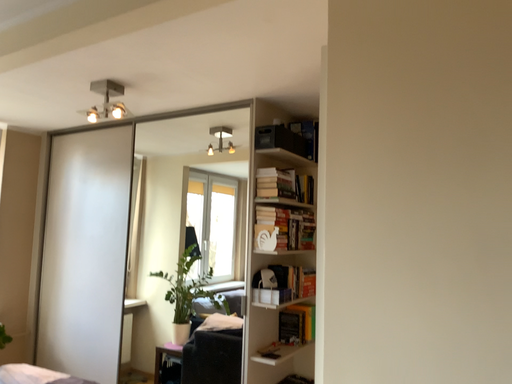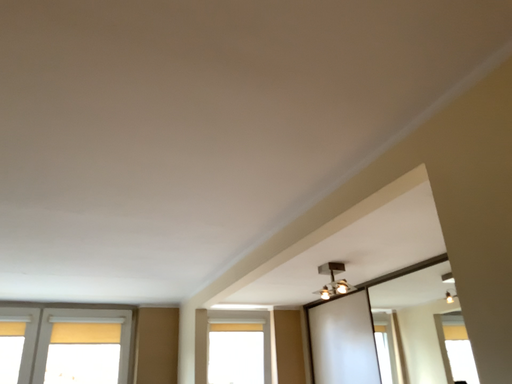
Question: Which way did the camera rotate in the video?

Choices:
 (A) rotated downward
 (B) rotated upward

Answer: (B)